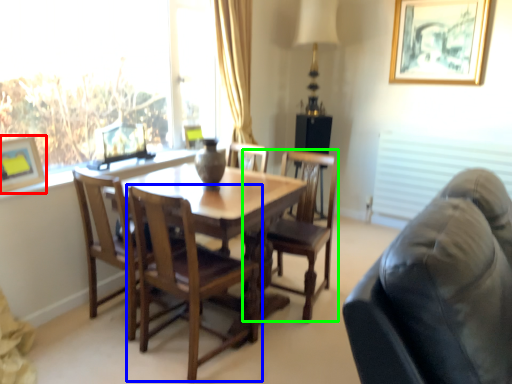
Question: Based on their relative distances, which object is farther from picture frame (highlighted by a red box)? Choose from chair (highlighted by a blue box) and chair (highlighted by a green box).

Choices:
 (A) chair
 (B) chair

Answer: (B)